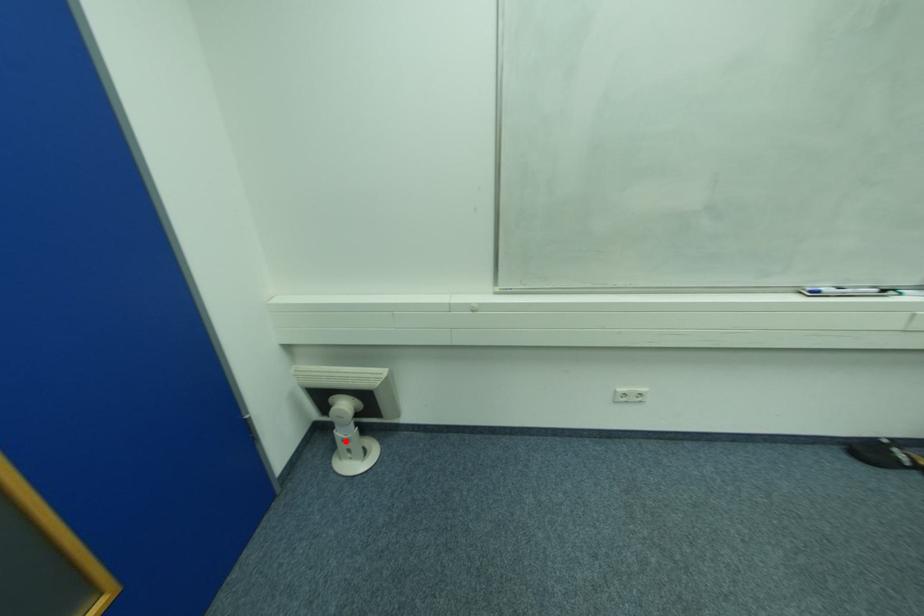
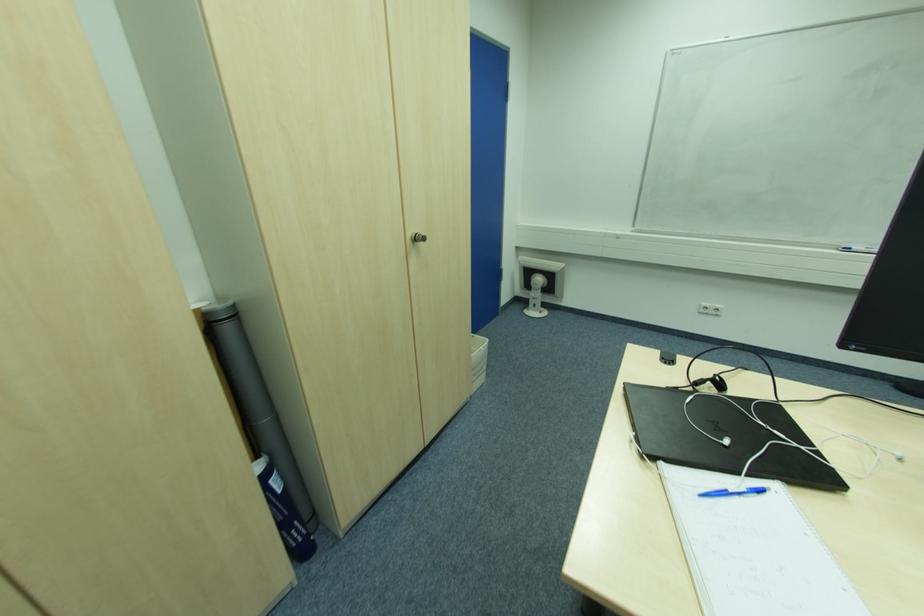
Question: A red point is marked in image1. In image2, is the corresponding 3D point closer to the camera or farther? Reply with the corresponding letter.

Choices:
 (A) The corresponding 3D point is closer.
 (B) The corresponding 3D point is farther.

Answer: (A)